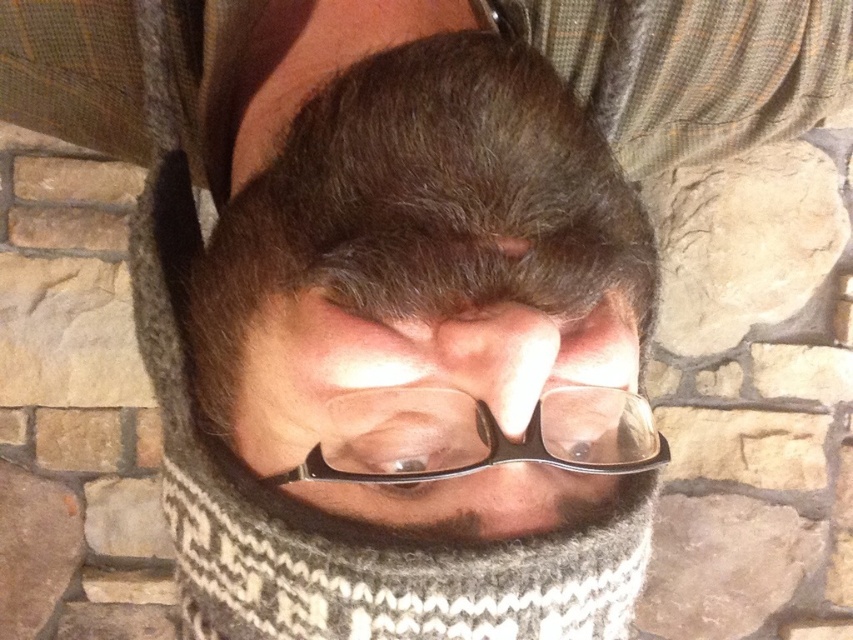
Question: Does matte black glasses at center have a smaller size compared to transparent plastic glasses at center?

Choices:
 (A) yes
 (B) no

Answer: (B)

Question: Is matte black glasses at center positioned in front of transparent plastic glasses at center?

Choices:
 (A) yes
 (B) no

Answer: (A)

Question: Is matte black glasses at center closer to the viewer compared to transparent plastic glasses at center?

Choices:
 (A) yes
 (B) no

Answer: (A)

Question: Which of the following is the farthest from the observer?

Choices:
 (A) transparent plastic glasses at center
 (B) matte black glasses at center

Answer: (A)